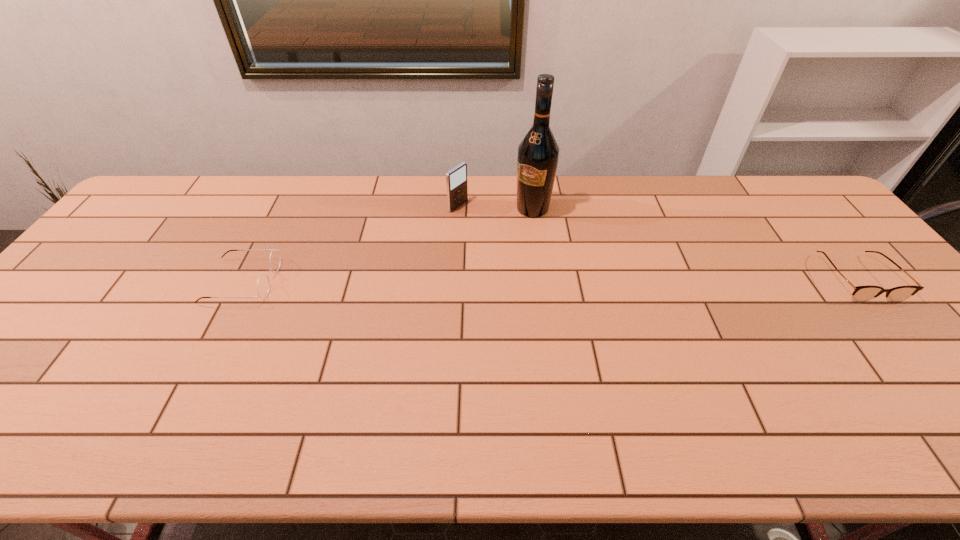
At what (x,y) coordinates should I click in order to perform the action: click on vacant region located on the label of the tallest object. Please return your answer as a coordinate pair (x, y). The image size is (960, 540). Looking at the image, I should click on (497, 252).

Find the location of `free space located 0.070m on the front-facing side of the iPod`. free space located 0.070m on the front-facing side of the iPod is located at coordinates (482, 219).

You are a GUI agent. You are given a task and a screenshot of the screen. Output one action in this format:
    pyautogui.click(x=<x>, y=<y>)
    Task: Click on the vacant space located on the front-facing side of the iPod
    
    Given the screenshot: What is the action you would take?
    pyautogui.click(x=546, y=252)

The width and height of the screenshot is (960, 540). In order to click on blank area located on the front-facing side of the iPod in this screenshot , I will do `click(573, 265)`.

Find the location of a particular element. The image size is (960, 540). wine bottle that is at the far edge is located at coordinates (537, 160).

At what (x,y) coordinates should I click in order to perform the action: click on iPod at the far edge. Please return your answer as a coordinate pair (x, y). This screenshot has width=960, height=540. Looking at the image, I should click on (456, 179).

Identify the location of object that is positioned at the right edge. The width and height of the screenshot is (960, 540). (861, 293).

Find the location of `vacant space at the far edge of the desktop`. vacant space at the far edge of the desktop is located at coordinates (347, 190).

Locate an element on the screen. free region at the near edge is located at coordinates (324, 396).

Where is `free space at the right edge of the desktop`? The width and height of the screenshot is (960, 540). free space at the right edge of the desktop is located at coordinates (894, 316).